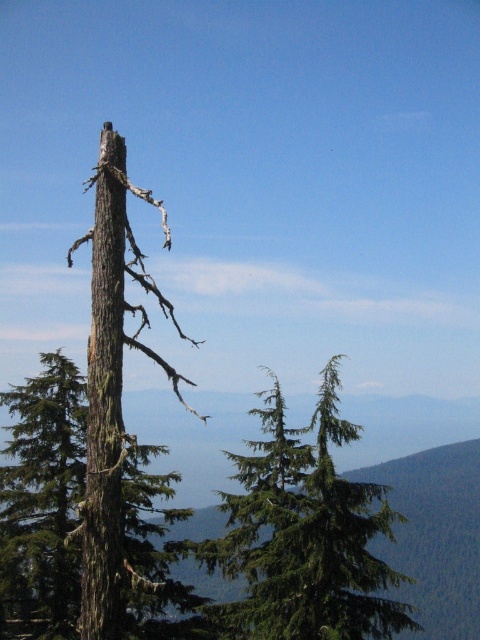
Consider the image. You are a photographer adjusting your camera settings to capture the scene. You notice two points marked in the image at coordinates point (31, 461) and point (90, 476). Which point should you focus on to ensure the foreground element is sharp?

You should focus on point (31, 461) because it is closer to the camera than point (90, 476), ensuring the foreground element is in sharp focus.

You are an arborist examining two trees in the image. The first is the brown rough bark tree at center and the second is the brown rough bark tree trunk at left. Based on their appearance, which tree might have a larger diameter?

The brown rough bark tree at center might be wider than brown rough bark tree trunk at left, so it likely has a larger diameter.